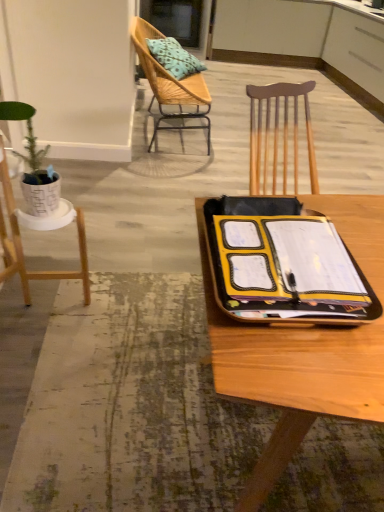
Question: Considering the relative sizes of white matte plant stand at left, which is counted as the second chair, starting from the top, and yellow matte notebook at center in the image provided, is white matte plant stand at left, which is counted as the second chair, starting from the top, smaller than yellow matte notebook at center?

Choices:
 (A) no
 (B) yes

Answer: (A)

Question: Considering the relative sizes of white matte plant stand at left, the 1th chair positioned from the front, and yellow matte notebook at center in the image provided, is white matte plant stand at left, the 1th chair positioned from the front, wider than yellow matte notebook at center?

Choices:
 (A) yes
 (B) no

Answer: (B)

Question: From a real-world perspective, does white matte plant stand at left, acting as the first chair starting from the bottom, stand above yellow matte notebook at center?

Choices:
 (A) yes
 (B) no

Answer: (B)

Question: Is white matte plant stand at left, the second chair when ordered from back to front, to the right of yellow matte notebook at center from the viewer's perspective?

Choices:
 (A) no
 (B) yes

Answer: (A)

Question: Is white matte plant stand at left, which is counted as the second chair, starting from the top, next to yellow matte notebook at center and touching it?

Choices:
 (A) yes
 (B) no

Answer: (B)

Question: Is white matte plant stand at left, acting as the first chair starting from the bottom, bigger than yellow matte notebook at center?

Choices:
 (A) no
 (B) yes

Answer: (B)

Question: Could you tell me if woven wood chair at upper left, the second chair from the bottom, is facing white matte plant stand at left, which is counted as the second chair, starting from the top?

Choices:
 (A) yes
 (B) no

Answer: (B)

Question: Does woven wood chair at upper left, which is counted as the second chair, starting from the front, touch white matte plant stand at left, which is counted as the second chair, starting from the top?

Choices:
 (A) no
 (B) yes

Answer: (A)

Question: Does woven wood chair at upper left, which is counted as the second chair, starting from the front, come in front of white matte plant stand at left, acting as the first chair starting from the bottom?

Choices:
 (A) no
 (B) yes

Answer: (A)

Question: Is woven wood chair at upper left, which is counted as the second chair, starting from the front, at the right side of white matte plant stand at left, the second chair when ordered from back to front?

Choices:
 (A) yes
 (B) no

Answer: (A)

Question: From the image's perspective, is woven wood chair at upper left, which is the first chair in top-to-bottom order, beneath white matte plant stand at left, the second chair when ordered from back to front?

Choices:
 (A) no
 (B) yes

Answer: (A)

Question: Considering the relative sizes of woven wood chair at upper left, which is the first chair in top-to-bottom order, and white matte plant stand at left, the 1th chair positioned from the front, in the image provided, is woven wood chair at upper left, which is the first chair in top-to-bottom order, wider than white matte plant stand at left, the 1th chair positioned from the front,?

Choices:
 (A) yes
 (B) no

Answer: (A)

Question: Is woven wood chair at upper left, which is counted as the second chair, starting from the front, smaller than yellow matte notebook at center?

Choices:
 (A) no
 (B) yes

Answer: (A)